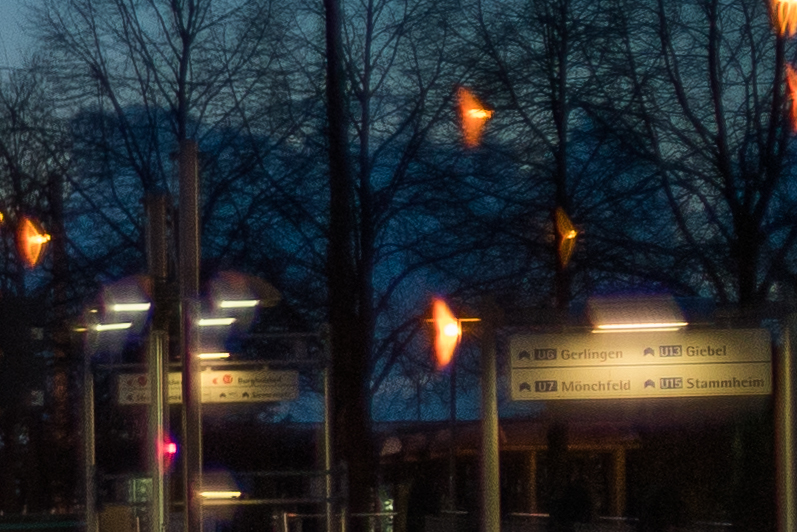
Locate an element on the screen. The width and height of the screenshot is (797, 532). light is located at coordinates (633, 336).